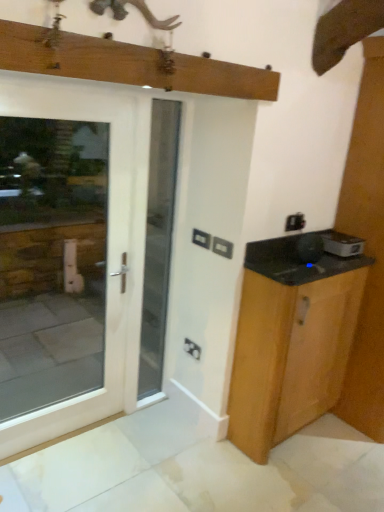
Where is `free spot above wooden beam at upper center (from a real-world perspective)`? This screenshot has height=512, width=384. free spot above wooden beam at upper center (from a real-world perspective) is located at coordinates (159, 40).